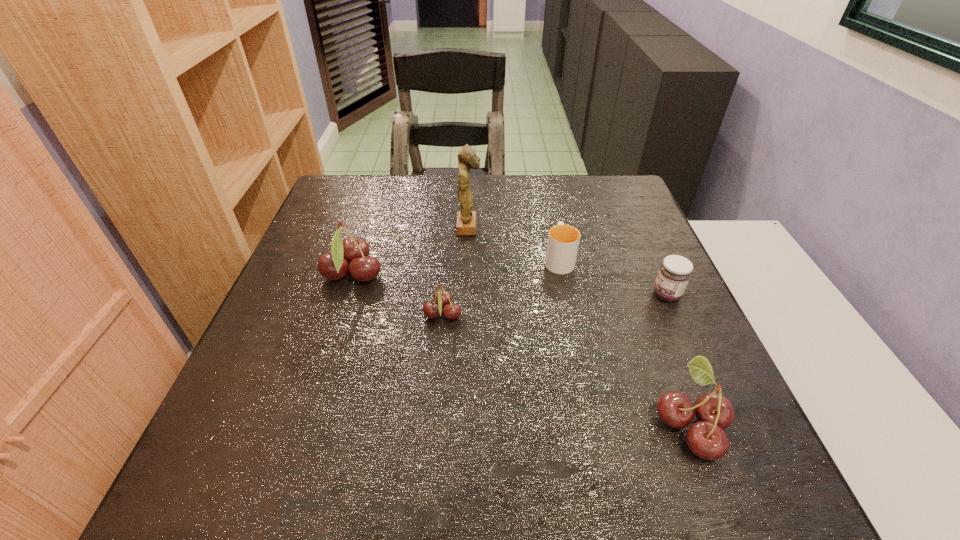
The image size is (960, 540). In the image, there is a desktop. Identify the location of vacant space at the far left corner. (361, 183).

Identify the location of vacant region between the leftmost cherry and the second cherry from right to left. The width and height of the screenshot is (960, 540). (398, 295).

At what (x,y) coordinates should I click in order to perform the action: click on free point between the jam and the leftmost cherry. Please return your answer as a coordinate pair (x, y). Looking at the image, I should click on (510, 285).

Where is `empty location between the farthest object and the second cherry from left to right`? This screenshot has height=540, width=960. empty location between the farthest object and the second cherry from left to right is located at coordinates (456, 271).

Identify the location of free spot between the third object from right to left and the shortest cherry. This screenshot has height=540, width=960. [x=501, y=287].

Image resolution: width=960 pixels, height=540 pixels. I want to click on unoccupied position between the second cherry from right to left and the cup, so click(501, 287).

This screenshot has width=960, height=540. I want to click on vacant area that lies between the rightmost cherry and the shortest cherry, so click(567, 369).

Where is `free point between the leftmost object and the nearest object`? The height and width of the screenshot is (540, 960). free point between the leftmost object and the nearest object is located at coordinates (522, 349).

Locate an element on the screen. The height and width of the screenshot is (540, 960). vacant area between the leftmost cherry and the farthest object is located at coordinates (411, 251).

In order to click on vacant space that is in between the fourth shortest object and the jam in this screenshot , I will do `click(679, 360)`.